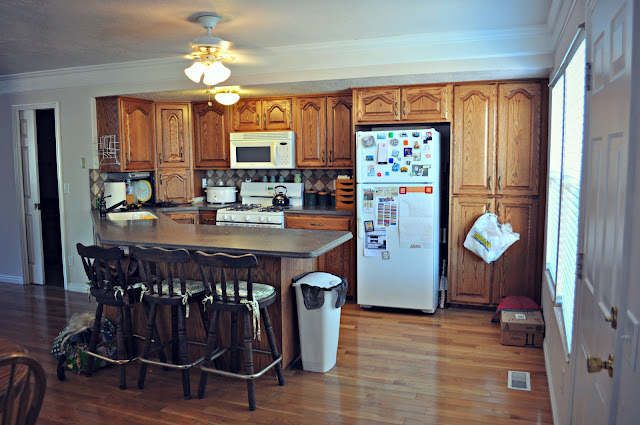
This screenshot has width=640, height=425. What are the coordinates of `counter top` in the screenshot? It's located at (241, 248).